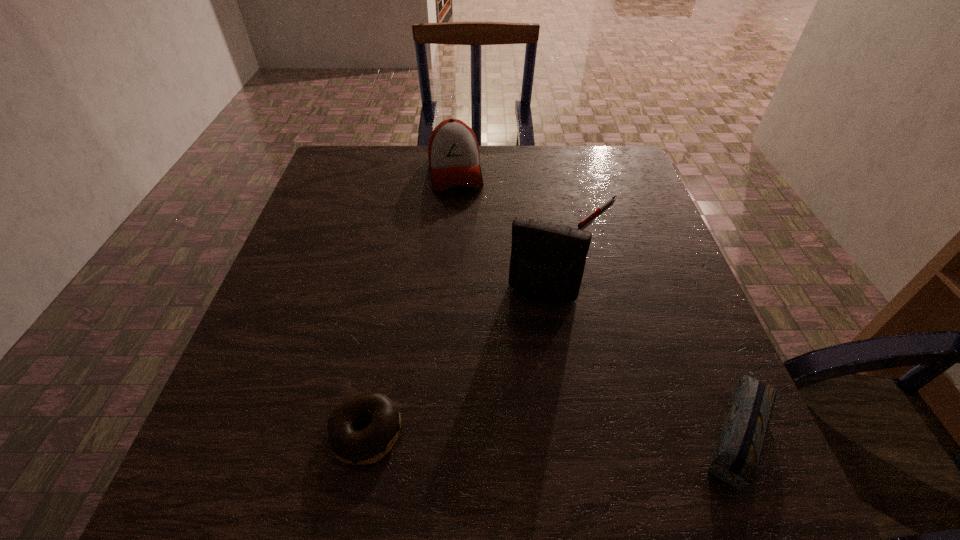
At what (x,y) coordinates should I click in order to perform the action: click on free spot between the third farthest object and the fourth shortest object. Please return your answer as a coordinate pair (x, y). The height and width of the screenshot is (540, 960). Looking at the image, I should click on (499, 233).

In order to click on free space between the doughnut and the third object from left to right in this screenshot , I will do `click(454, 363)`.

The height and width of the screenshot is (540, 960). In order to click on free space between the third nearest object and the fourth tallest object in this screenshot , I will do `click(454, 363)`.

I want to click on free spot between the baseball cap and the second shortest object, so click(411, 302).

Where is `vacant point located between the pen and the baseball cap`? This screenshot has height=540, width=960. vacant point located between the pen and the baseball cap is located at coordinates (527, 192).

Image resolution: width=960 pixels, height=540 pixels. What are the coordinates of `vacant space that is in between the pouch and the doughnut` in the screenshot? It's located at (454, 363).

This screenshot has width=960, height=540. I want to click on free point between the fourth tallest object and the baseball cap, so click(411, 302).

Find the location of `vacant area that lies between the pencil box and the baseball cap`. vacant area that lies between the pencil box and the baseball cap is located at coordinates (595, 300).

The image size is (960, 540). I want to click on object that stands as the fourth closest to the pencil box, so click(454, 157).

Choose which object is the fourth nearest neighbor to the pen. Please provide its 2D coordinates. Your answer should be formatted as a tuple, i.e. [(x, y)], where the tuple contains the x and y coordinates of a point satisfying the conditions above.

[(366, 446)]